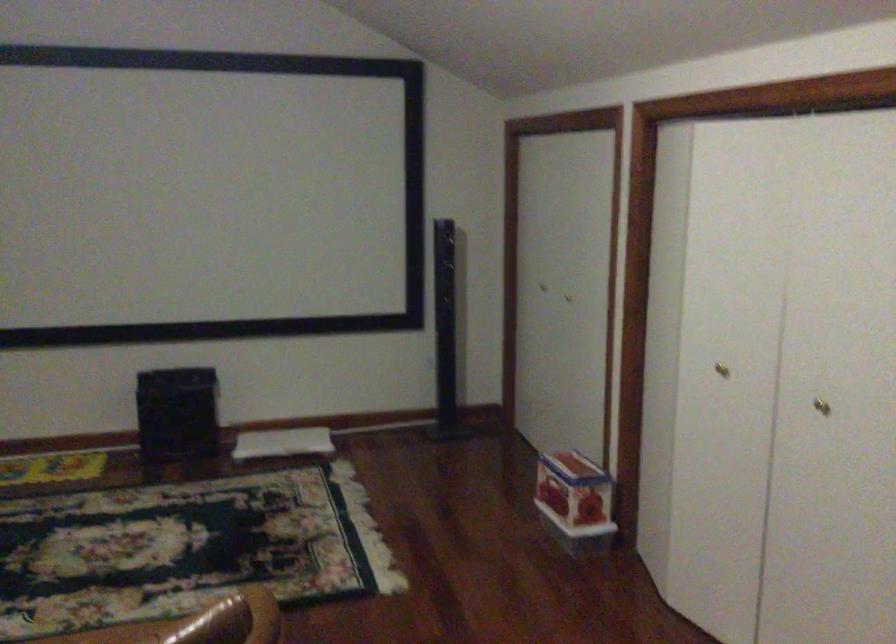
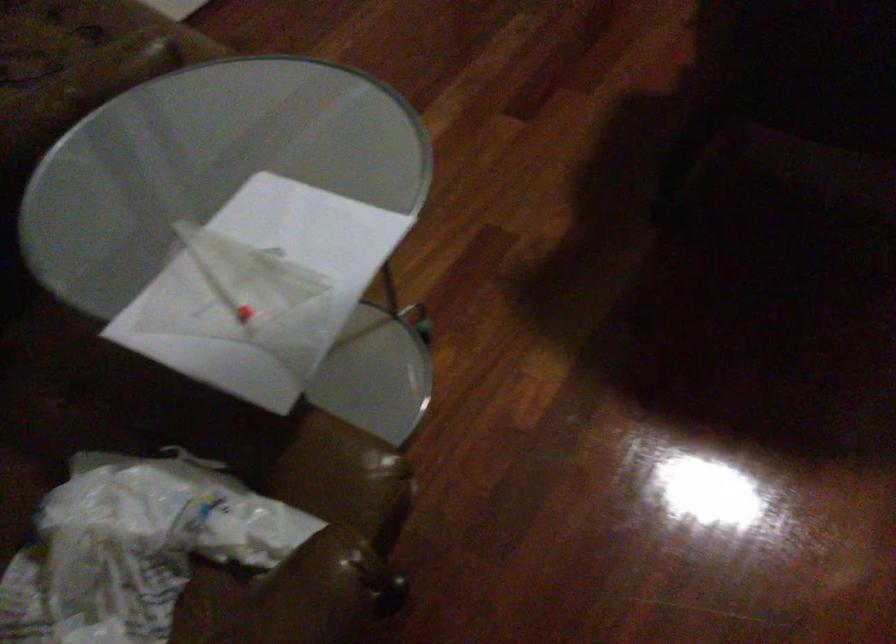
The images are taken continuously from a first-person perspective. In which direction is your viewpoint rotating?

The rotation direction of the camera is left-down.